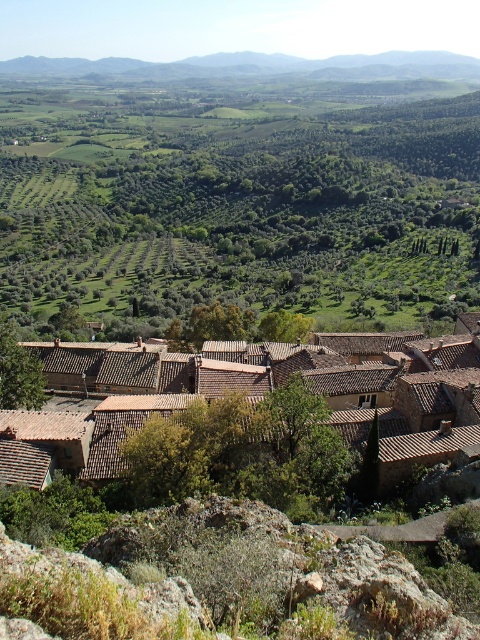
Question: Which point is farther from the camera taking this photo?

Choices:
 (A) (335, 68)
 (B) (360, 310)

Answer: (A)

Question: Which point is farther from the camera taking this photo?

Choices:
 (A) (470, 224)
 (B) (26, 348)

Answer: (A)

Question: Does green leafy trees at center have a smaller size compared to gray rocky mountain at upper center?

Choices:
 (A) no
 (B) yes

Answer: (A)

Question: Which point appears farthest from the camera in this image?

Choices:
 (A) (406, 474)
 (B) (24, 310)

Answer: (B)

Question: Can you confirm if green leafy trees at center is smaller than brown clay roof tiles at center?

Choices:
 (A) yes
 (B) no

Answer: (B)

Question: Does green leafy trees at center appear on the left side of brown clay roof tiles at center?

Choices:
 (A) no
 (B) yes

Answer: (A)